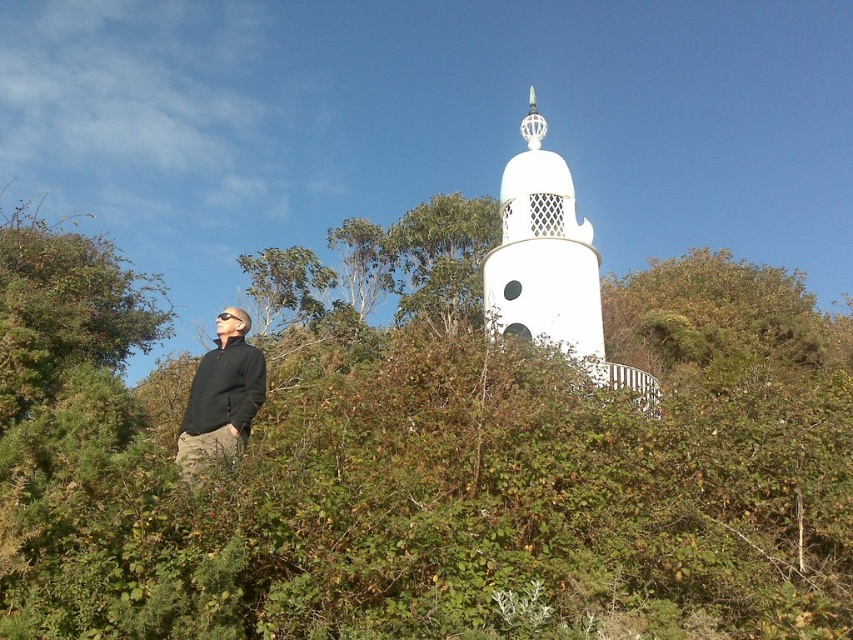
You are a hiker who wants to take a photo of the white tower in the background. You notice the green leafy bush at center and the black matte jacket at lower left in your current view. Which object is blocking your view of the tower?

The green leafy bush at center is blocking your view because it is much taller than the black matte jacket at lower left, so it is more likely to obstruct the line of sight to the tower.